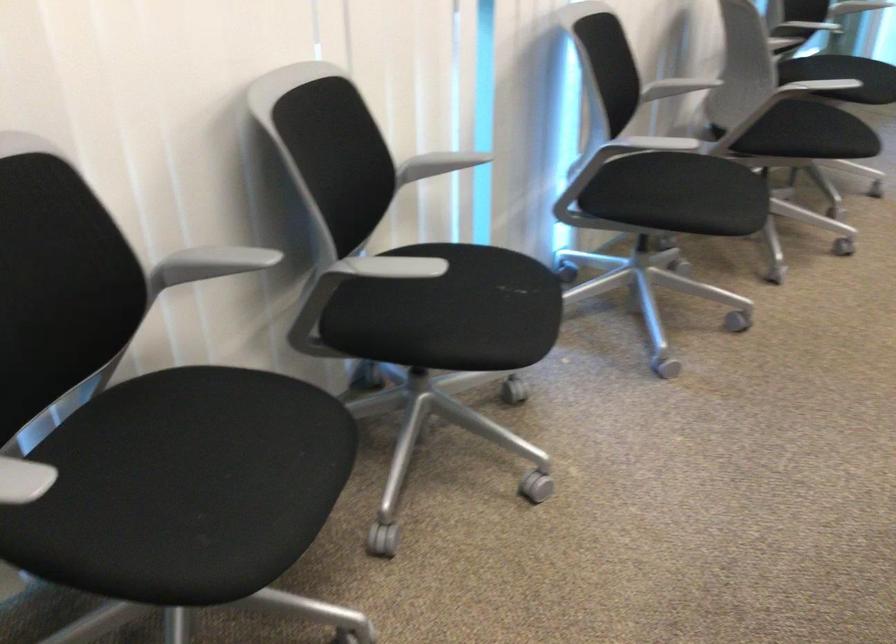
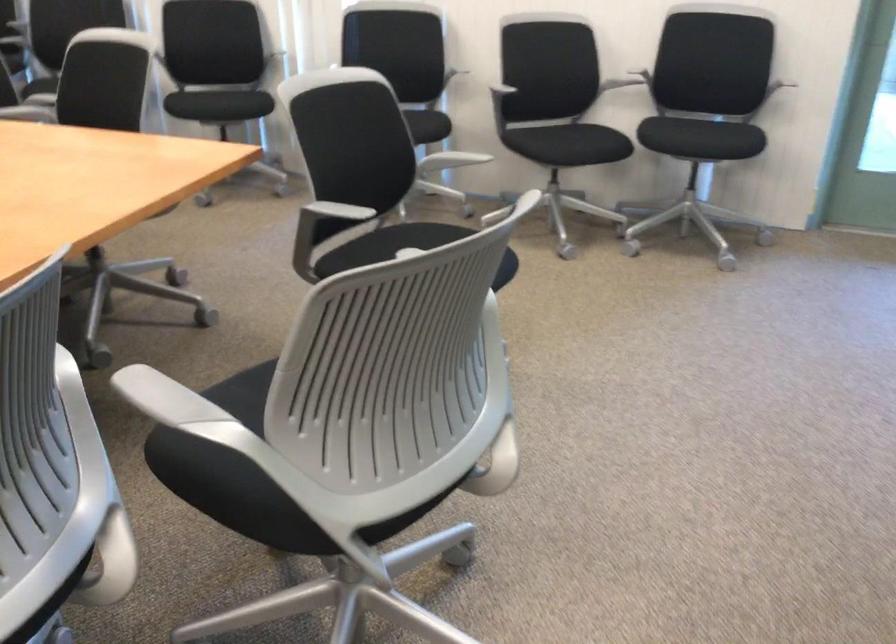
Locate, in the second image, the point that corresponds to the point at 702,178 in the first image.

(426, 126)